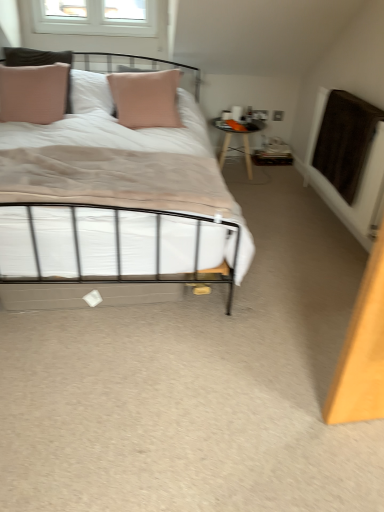
Find the location of a particular element. Image resolution: width=384 pixels, height=512 pixels. free region under wooden table at right (from a real-world perspective) is located at coordinates (237, 174).